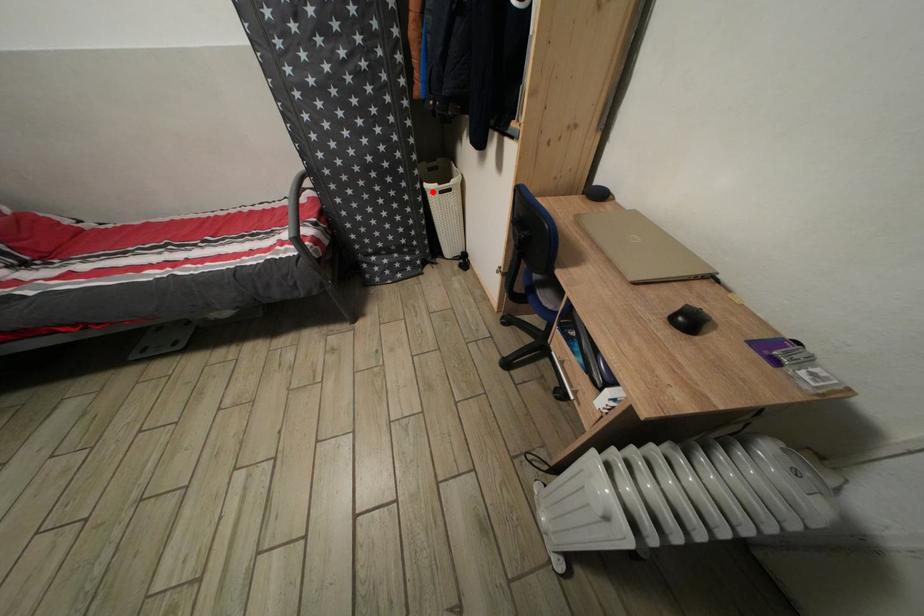
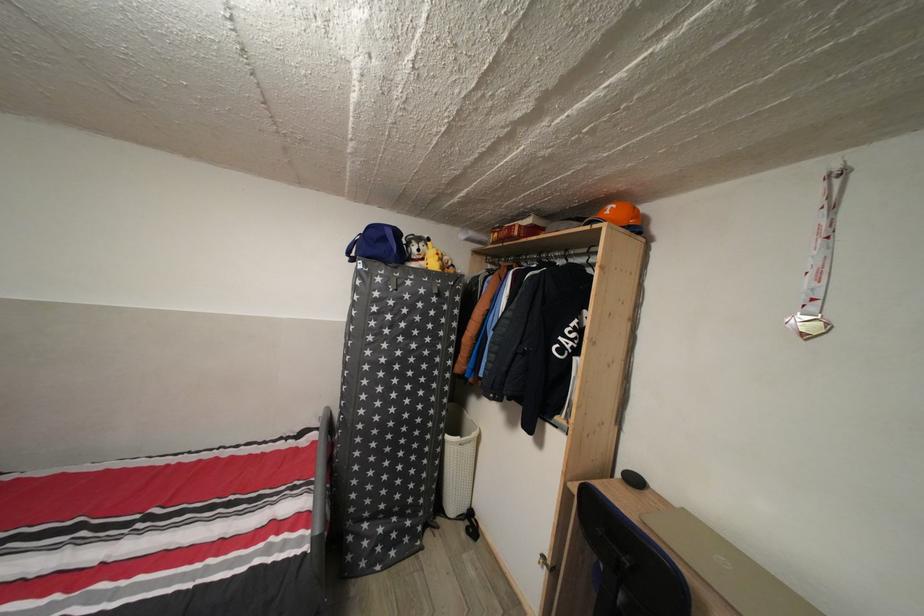
Find the pixel in the second image that matches the highlighted location in the first image.

(455, 444)